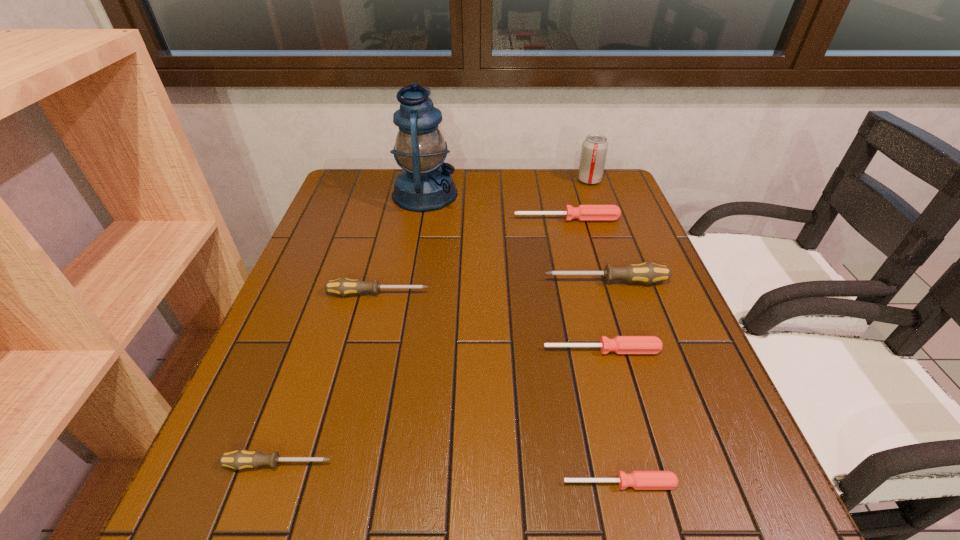
Locate an element on the screen. The image size is (960, 540). lantern is located at coordinates (425, 184).

Where is `the tallest object`? the tallest object is located at coordinates (425, 184).

Identify the location of the seventh shortest object. (594, 148).

The width and height of the screenshot is (960, 540). I want to click on soda can, so click(x=594, y=148).

Identify the location of the tallest screwdriver. (647, 272).

This screenshot has height=540, width=960. In order to click on the rightmost gray screwdriver in this screenshot , I will do `click(647, 272)`.

Find the location of a particular element. the second smallest gray screwdriver is located at coordinates (343, 286).

You are a GUI agent. You are given a task and a screenshot of the screen. Output one action in this format:
    pyautogui.click(x=<x>, y=<y>)
    Task: Click on the farthest screwdriver
    This screenshot has height=540, width=960.
    Given the screenshot: What is the action you would take?
    pyautogui.click(x=583, y=212)

At what (x,y) coordinates should I click in order to perform the action: click on the biggest red screwdriver. Please return your answer as a coordinate pair (x, y). Looking at the image, I should click on (583, 212).

Find the location of `the fourth farthest screwdriver`. the fourth farthest screwdriver is located at coordinates (620, 344).